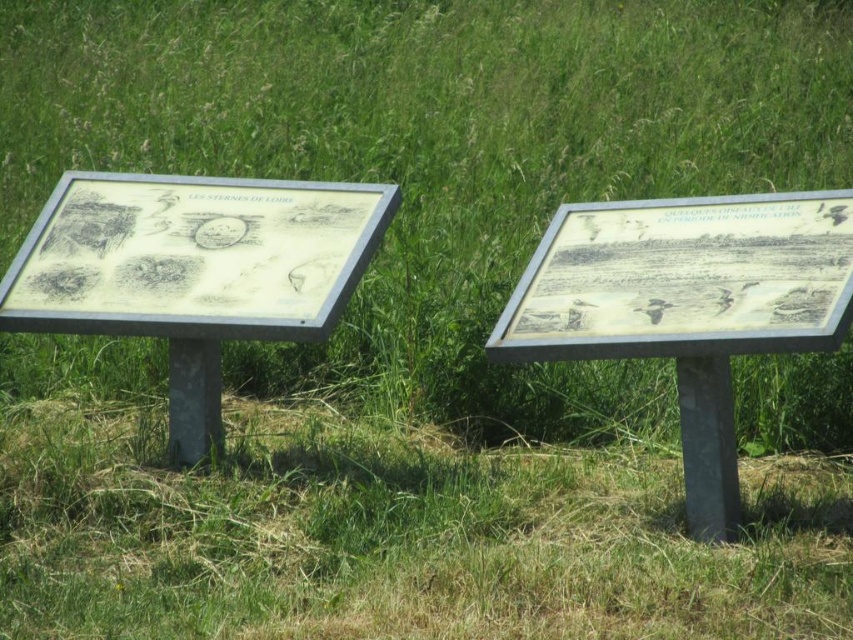
Is matte paper sign at left bigger than matte silver sign at right?

Yes, matte paper sign at left is bigger than matte silver sign at right.

Is point (239, 268) less distant than point (602, 348)?

That is False.

Does point (39, 294) come farther from viewer compared to point (668, 212)?

Yes.

Locate an element on the screen. The height and width of the screenshot is (640, 853). matte paper sign at left is located at coordinates (193, 257).